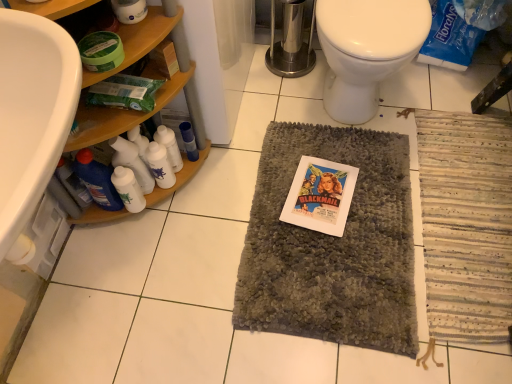
Where is `vacant space that is in between white glossy bottles at left, which is the 3th bottle from right to left, and gray shaggy mat at center`? The height and width of the screenshot is (384, 512). vacant space that is in between white glossy bottles at left, which is the 3th bottle from right to left, and gray shaggy mat at center is located at coordinates (220, 206).